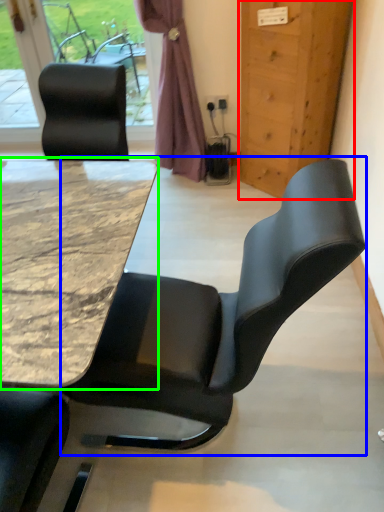
Question: Which is farther away from door (highlighted by a red box)? chair (highlighted by a blue box) or table (highlighted by a green box)?

Choices:
 (A) chair
 (B) table

Answer: (A)